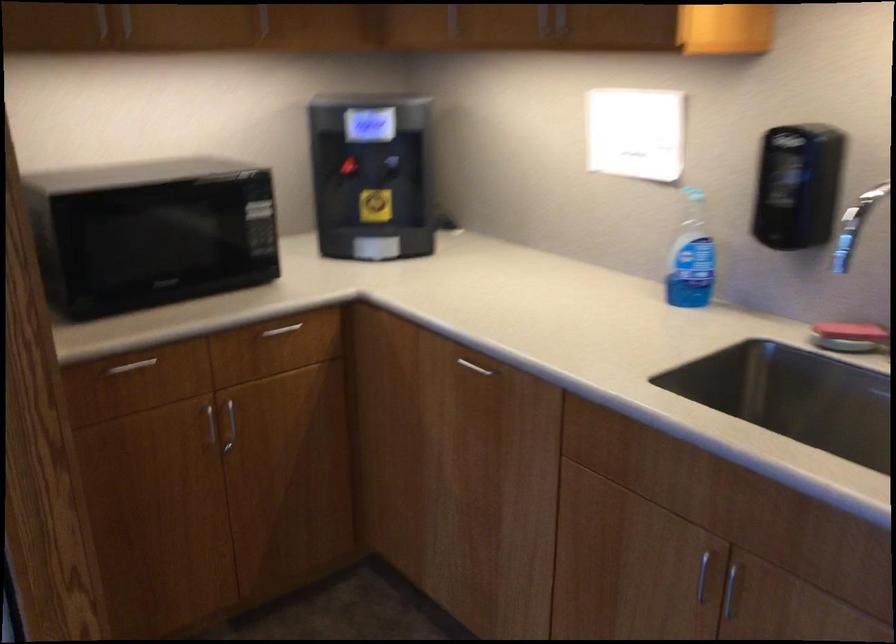
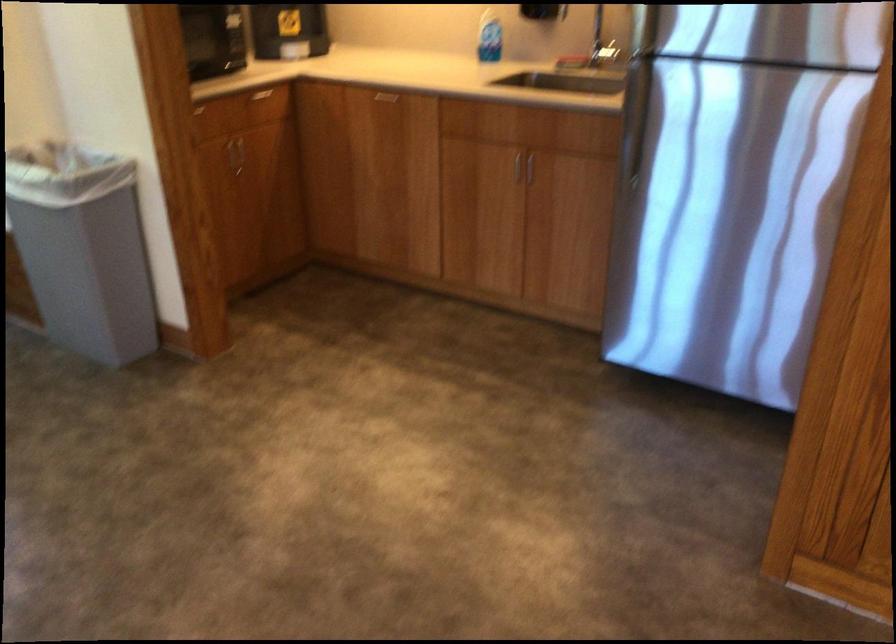
In the second image, find the point that corresponds to point (235, 418) in the first image.

(239, 151)